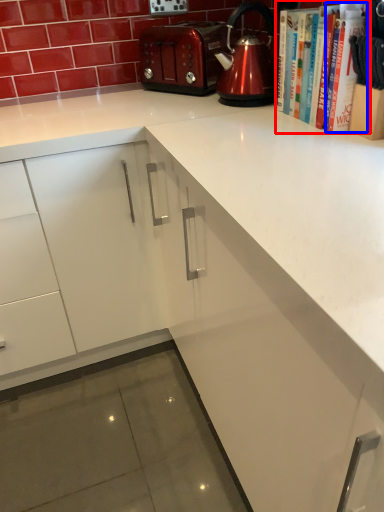
Question: Which point is closer to the camera, book (highlighted by a red box) or book (highlighted by a blue box)?

Choices:
 (A) book
 (B) book

Answer: (B)